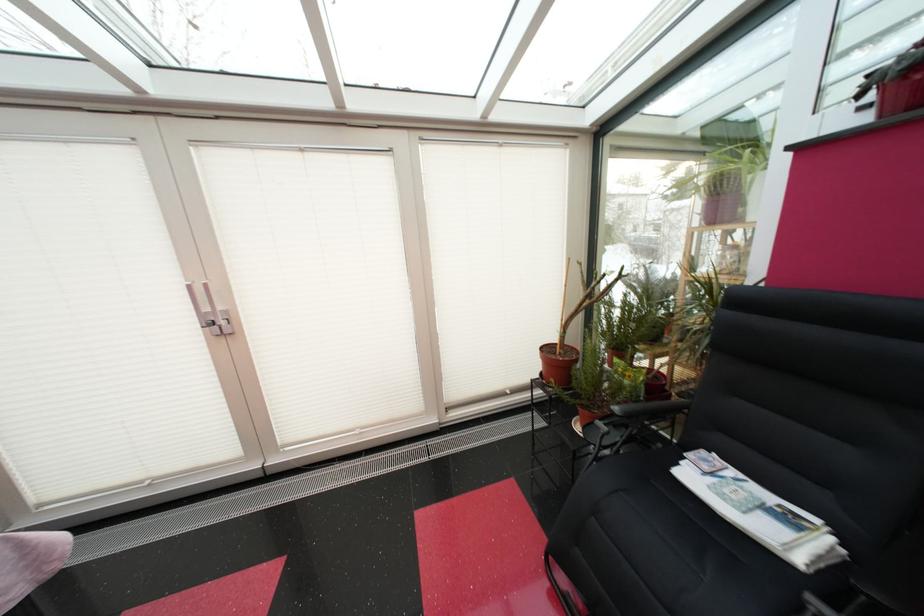
This screenshot has height=616, width=924. Identify the location of black chair armrest. (657, 408).